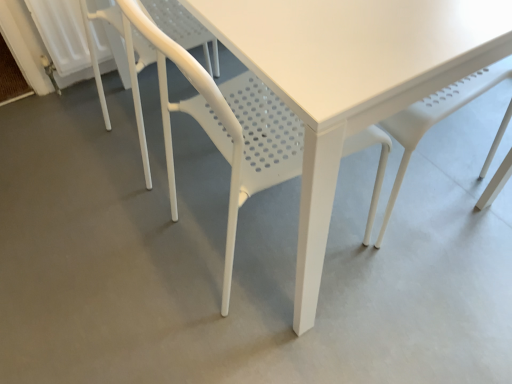
The image size is (512, 384). Identify the location of free location in front of white plastic chair at center, the 1th chair positioned from the right. 281,341.